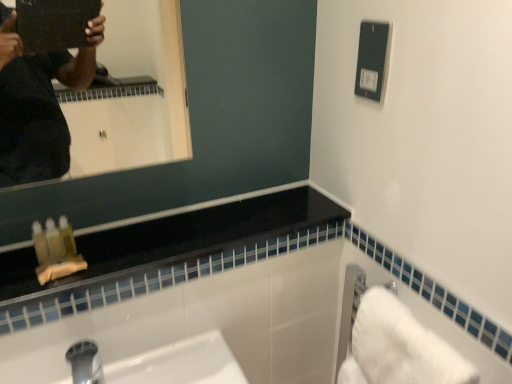
This screenshot has width=512, height=384. Describe the element at coordinates (399, 347) in the screenshot. I see `white fluffy hand towel at lower right` at that location.

I want to click on white fluffy hand towel at lower right, so click(x=399, y=347).

Measure the distance between point (x=377, y=301) and camera.

The depth of point (x=377, y=301) is 31.30 inches.

Locate an element on the screen. The height and width of the screenshot is (384, 512). white fluffy hand towel at lower right is located at coordinates (399, 347).